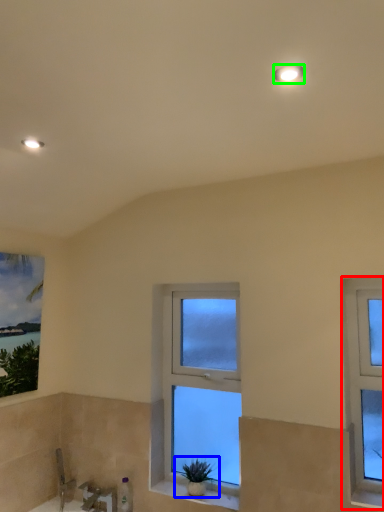
Question: Considering the real-world distances, which object is closest to window (highlighted by a red box)? houseplant (highlighted by a blue box) or light fixture (highlighted by a green box).

Choices:
 (A) houseplant
 (B) light fixture

Answer: (A)